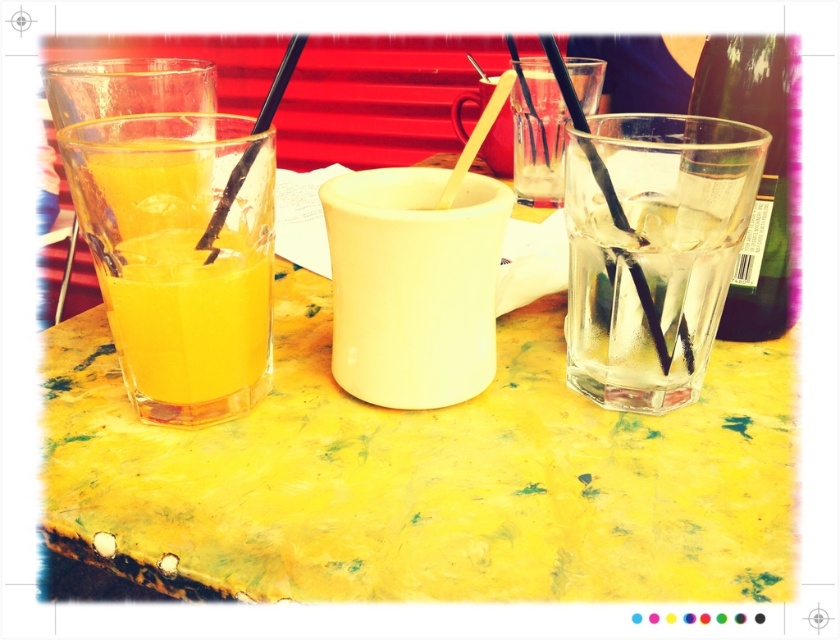
Is green glass bottle at right closer to camera compared to transparent plastic straw at left?

No, green glass bottle at right is further to the viewer.

Who is more distant from viewer, [691,96] or [218,220]?

Positioned behind is point [691,96].

This screenshot has height=640, width=840. Identify the location of green glass bottle at right. (760, 173).

Can you confirm if yellow textured table at center is positioned above transparent plastic straw at left?

No, yellow textured table at center is not above transparent plastic straw at left.

Does point (297, 369) come closer to viewer compared to point (297, 38)?

No, it is not.

Locate an element on the screen. yellow textured table at center is located at coordinates (426, 477).

Which is more to the right, white matte cup at center or green glass bottle at right?

Positioned to the right is green glass bottle at right.

Image resolution: width=840 pixels, height=640 pixels. What do you see at coordinates (413, 284) in the screenshot? I see `white matte cup at center` at bounding box center [413, 284].

The height and width of the screenshot is (640, 840). I want to click on white matte cup at center, so click(x=413, y=284).